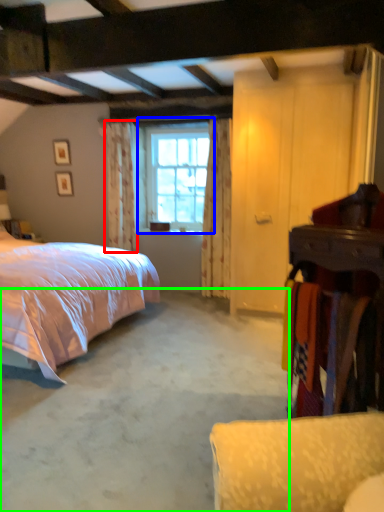
Question: Which object is the closest to the curtain (highlighted by a red box)? Choose among these: window (highlighted by a blue box) or concrete (highlighted by a green box).

Choices:
 (A) window
 (B) concrete

Answer: (A)